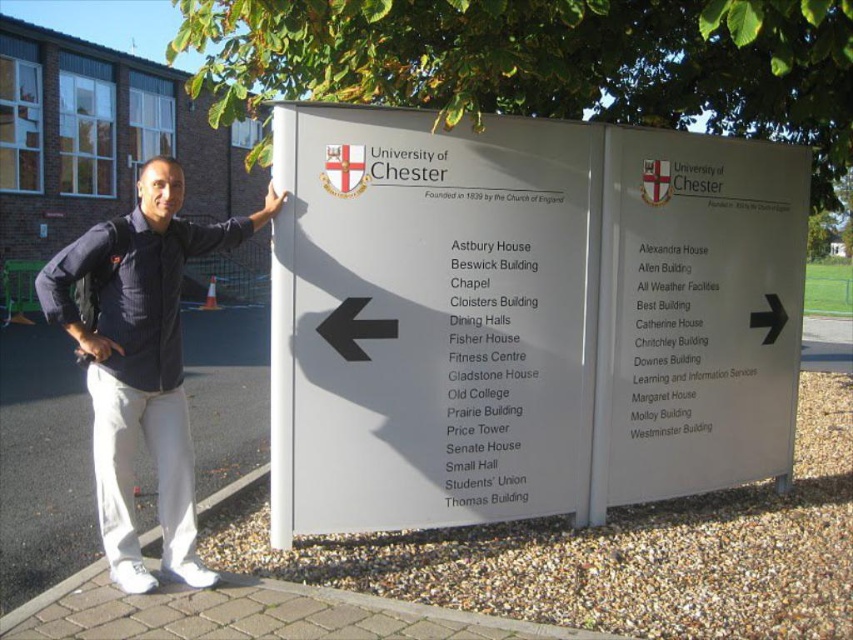
Can you confirm if white plastic sign at center is wider than white matte sign at right?

Yes.

Does point (503, 298) come farther from viewer compared to point (650, 429)?

No, (503, 298) is in front of (650, 429).

Is point (527, 380) positioned behind point (614, 173)?

No, it is not.

At what (x,y) coordinates should I click in order to perform the action: click on white plastic sign at center. Please return your answer as a coordinate pair (x, y). Image resolution: width=853 pixels, height=640 pixels. Looking at the image, I should click on (524, 317).

Does white matte sign at right have a lesser width compared to dark blue shirt at upper left?

No, white matte sign at right is not thinner than dark blue shirt at upper left.

Is white matte sign at right taller than dark blue shirt at upper left?

Yes.

Between point (779, 381) and point (221, 240), which one is positioned behind?

The point (779, 381) is behind.

Identify the location of white matte sign at right. This screenshot has width=853, height=640. (695, 314).

Is point (750, 196) farther from viewer compared to point (99, 342)?

That is True.

Between white plastic sign at center and dark blue shirt at upper left, which one appears on the left side from the viewer's perspective?

dark blue shirt at upper left is more to the left.

Which is in front, point (660, 496) or point (178, 556)?

Point (178, 556) is in front.

Image resolution: width=853 pixels, height=640 pixels. I want to click on white plastic sign at center, so click(524, 317).